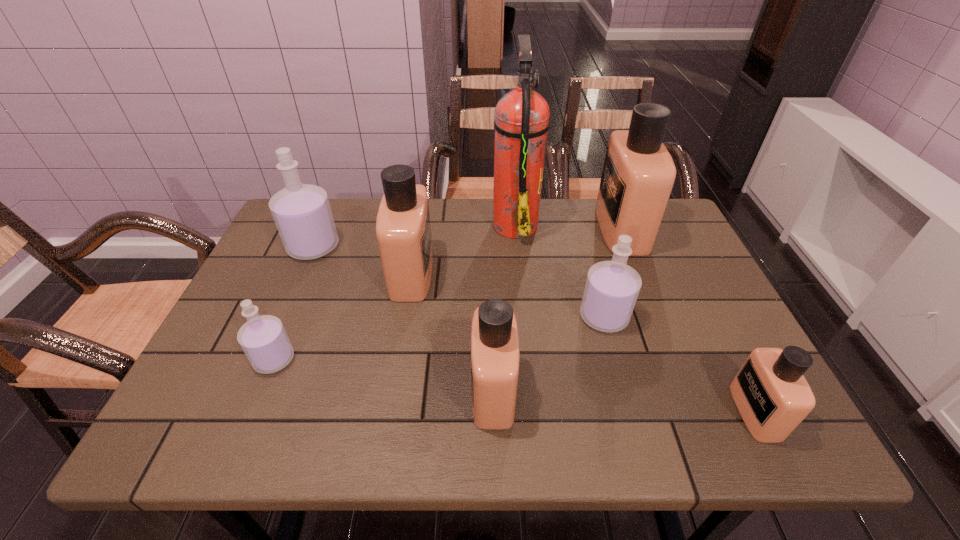
Locate an element on the screen. This screenshot has width=960, height=540. object that is the fourth closest to the sixth perfume from left to right is located at coordinates (x=495, y=358).

Locate an element on the screen. object that stands as the second closest to the second smallest beige perfume is located at coordinates (403, 230).

Image resolution: width=960 pixels, height=540 pixels. I want to click on the third closest perfume relative to the second beige perfume from left to right, so click(x=263, y=339).

Locate which perfume is the sixth closest to the farthest purple perfume. Please provide its 2D coordinates. Your answer should be formatted as a tuple, i.e. [(x, y)], where the tuple contains the x and y coordinates of a point satisfying the conditions above.

[(773, 397)]

Where is `beige perfume that is the closest one to the third perfume from left to right`? beige perfume that is the closest one to the third perfume from left to right is located at coordinates (495, 358).

This screenshot has width=960, height=540. What are the coordinates of `the closest beige perfume to the tallest object` in the screenshot? It's located at (403, 230).

Choose which purple perfume is the third nearest neighbor to the tallest perfume. Please provide its 2D coordinates. Your answer should be formatted as a tuple, i.e. [(x, y)], where the tuple contains the x and y coordinates of a point satisfying the conditions above.

[(263, 339)]

At what (x,y) coordinates should I click in order to perform the action: click on purple perfume identified as the third closest to the rightmost beige perfume. Please return your answer as a coordinate pair (x, y). The image size is (960, 540). Looking at the image, I should click on (302, 214).

At what (x,y) coordinates should I click in order to perform the action: click on free space that satisfies the following two spatial constraints: 1. at the nozzle of the tallest object; 2. on the front side of the farthest purple perfume. Please return your answer as a coordinate pair (x, y). Image resolution: width=960 pixels, height=540 pixels. Looking at the image, I should click on (517, 247).